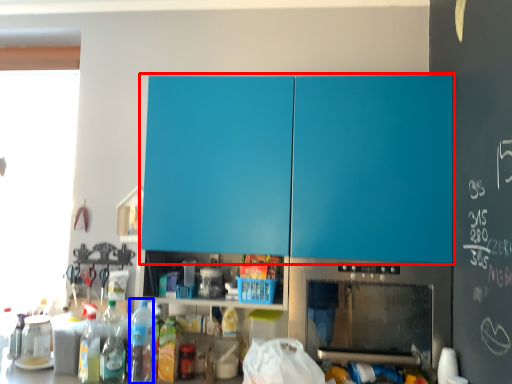
Question: Which object appears closest to the camera in this image, cabinetry (highlighted by a red box) or bottle (highlighted by a blue box)?

Choices:
 (A) cabinetry
 (B) bottle

Answer: (A)